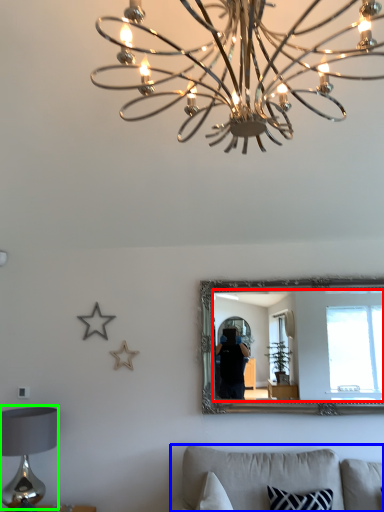
Question: Which object is the farthest from mirror (highlighted by a red box)? Choose among these: furniture (highlighted by a blue box) or table lamp (highlighted by a green box).

Choices:
 (A) furniture
 (B) table lamp

Answer: (B)